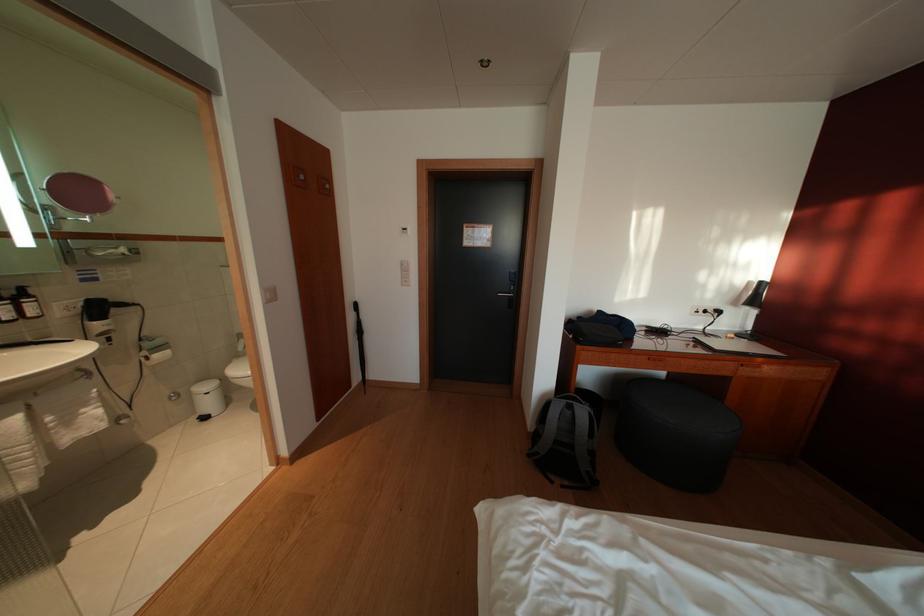
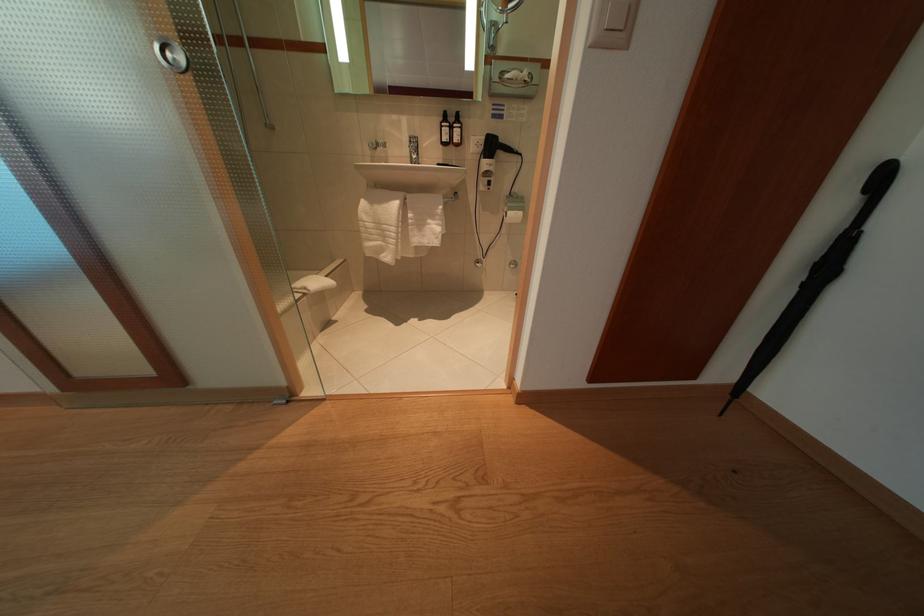
Where in the second image is the point corresponding to (368,338) from the first image?

(834, 275)